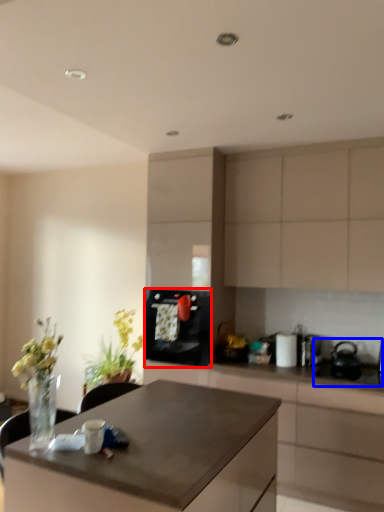
Question: Among these objects, which one is farthest to the camera, kitchen appliance (highlighted by a red box) or sink (highlighted by a blue box)?

Choices:
 (A) kitchen appliance
 (B) sink

Answer: (A)